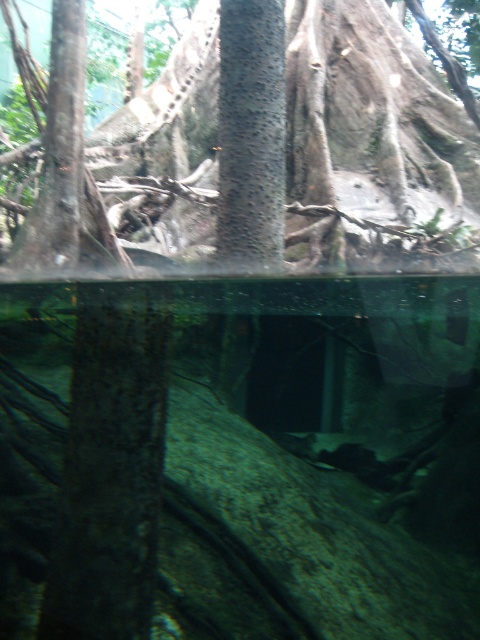
You are a nature photographer wanting to capture the width comparison between the rough bark tree at center and the rough bark tree trunk at center. Which one should you focus on to get a wider shot?

The rough bark tree at center is wider than the rough bark tree trunk at center, so you should focus on the rough bark tree at center to capture its wider width.

You are a snorkeler observing the underwater scene. You see the rough bark tree at center and the rough bark tree trunk at center. Which one is closer to you?

The rough bark tree at center is closer to you because it is further to the viewer than the rough bark tree trunk at center.